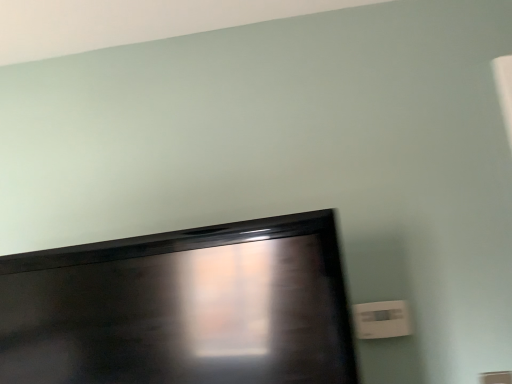
What do you see at coordinates (182, 308) in the screenshot? I see `matte black tv at lower left` at bounding box center [182, 308].

You are a GUI agent. You are given a task and a screenshot of the screen. Output one action in this format:
    pyautogui.click(x=<x>, y=<y>)
    Task: Click on the matte black tv at lower left
    
    Given the screenshot: What is the action you would take?
    pyautogui.click(x=182, y=308)

At what (x,y) coordinates should I click in order to perform the action: click on white plastic electric outlet at lower right. Please return your answer as a coordinate pair (x, y). Looking at the image, I should click on (381, 319).

What do you see at coordinates (381, 319) in the screenshot? I see `white plastic electric outlet at lower right` at bounding box center [381, 319].

This screenshot has width=512, height=384. Identify the location of matte black tv at lower left. (182, 308).

Considering the positions of objects matte black tv at lower left and white plastic electric outlet at lower right in the image provided, who is more to the right, matte black tv at lower left or white plastic electric outlet at lower right?

Positioned to the right is white plastic electric outlet at lower right.

Relative to white plastic electric outlet at lower right, is matte black tv at lower left in front or behind?

matte black tv at lower left is positioned closer to the viewer than white plastic electric outlet at lower right.

Is point (255, 374) positioned after point (386, 330)?

No, (255, 374) is closer to viewer.

From the image's perspective, is matte black tv at lower left located above white plastic electric outlet at lower right?

Indeed, from the image's perspective, matte black tv at lower left is shown above white plastic electric outlet at lower right.

From a real-world perspective, which object stands above the other?

matte black tv at lower left is physically above.

Which of these two, matte black tv at lower left or white plastic electric outlet at lower right, is wider?

Wider between the two is matte black tv at lower left.

Which of these two, matte black tv at lower left or white plastic electric outlet at lower right, stands taller?

matte black tv at lower left is taller.

Does matte black tv at lower left have a smaller size compared to white plastic electric outlet at lower right?

Actually, matte black tv at lower left might be larger than white plastic electric outlet at lower right.

Is white plastic electric outlet at lower right located within matte black tv at lower left?

No, white plastic electric outlet at lower right is not surrounded by matte black tv at lower left.

Can you see matte black tv at lower left touching white plastic electric outlet at lower right?

No, matte black tv at lower left is not beside white plastic electric outlet at lower right.

Does matte black tv at lower left turn towards white plastic electric outlet at lower right?

No.

How different are the orientations of matte black tv at lower left and white plastic electric outlet at lower right in degrees?

The angular difference between matte black tv at lower left and white plastic electric outlet at lower right is 4.21 degrees.

Where is `electric outlet located underneath the matte black tv at lower left (from a real-world perspective)`? The width and height of the screenshot is (512, 384). electric outlet located underneath the matte black tv at lower left (from a real-world perspective) is located at coordinates (381, 319).

Which object is positioned more to the left, white plastic electric outlet at lower right or matte black tv at lower left?

matte black tv at lower left.

Is the depth of white plastic electric outlet at lower right greater than that of matte black tv at lower left?

Yes, it is.

Considering the positions of points (362, 305) and (206, 304), is point (362, 305) farther from camera compared to point (206, 304)?

Yes, point (362, 305) is behind point (206, 304).

From the picture: From the image's perspective, is white plastic electric outlet at lower right under matte black tv at lower left?

Correct, white plastic electric outlet at lower right appears lower than matte black tv at lower left in the image.

From a real-world perspective, is white plastic electric outlet at lower right physically located above or below matte black tv at lower left?

white plastic electric outlet at lower right is situated lower than matte black tv at lower left in the real world.

Is white plastic electric outlet at lower right wider or thinner than matte black tv at lower left?

Considering their sizes, white plastic electric outlet at lower right looks slimmer than matte black tv at lower left.

Consider the image. Which of these two, white plastic electric outlet at lower right or matte black tv at lower left, stands shorter?

white plastic electric outlet at lower right is shorter.

Considering the relative sizes of white plastic electric outlet at lower right and matte black tv at lower left in the image provided, is white plastic electric outlet at lower right bigger than matte black tv at lower left?

Actually, white plastic electric outlet at lower right might be smaller than matte black tv at lower left.

Is matte black tv at lower left completely or partially inside white plastic electric outlet at lower right?

No, matte black tv at lower left is not inside white plastic electric outlet at lower right.

Does white plastic electric outlet at lower right touch matte black tv at lower left?

No, white plastic electric outlet at lower right is not in contact with matte black tv at lower left.

In the scene shown: Is white plastic electric outlet at lower right facing towards matte black tv at lower left?

No, white plastic electric outlet at lower right does not turn towards matte black tv at lower left.

What's the angular difference between white plastic electric outlet at lower right and matte black tv at lower left's facing directions?

The angular difference between white plastic electric outlet at lower right and matte black tv at lower left is 4.21 degrees.

Where is `electric outlet on the right of matte black tv at lower left`? This screenshot has height=384, width=512. electric outlet on the right of matte black tv at lower left is located at coordinates (381, 319).

You are a GUI agent. You are given a task and a screenshot of the screen. Output one action in this format:
    pyautogui.click(x=<x>, y=<y>)
    Task: Click on the television that is on the left side of white plastic electric outlet at lower right
    Image resolution: width=512 pixels, height=384 pixels.
    Given the screenshot: What is the action you would take?
    pyautogui.click(x=182, y=308)

The image size is (512, 384). In order to click on television above the white plastic electric outlet at lower right (from a real-world perspective) in this screenshot , I will do `click(182, 308)`.